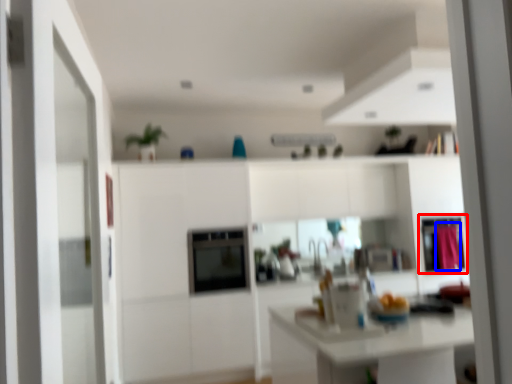
Question: Which point is closer to the camera, cabinetry (highlighted by a red box) or curtain (highlighted by a blue box)?

Choices:
 (A) cabinetry
 (B) curtain

Answer: (B)